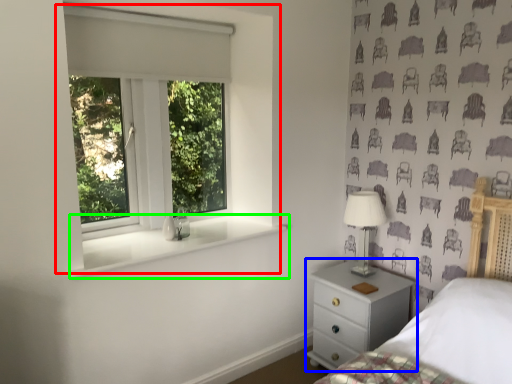
Question: Which object is the closest to the window (highlighted by a red box)? Choose among these: chest of drawers (highlighted by a blue box) or window sill (highlighted by a green box).

Choices:
 (A) chest of drawers
 (B) window sill

Answer: (B)